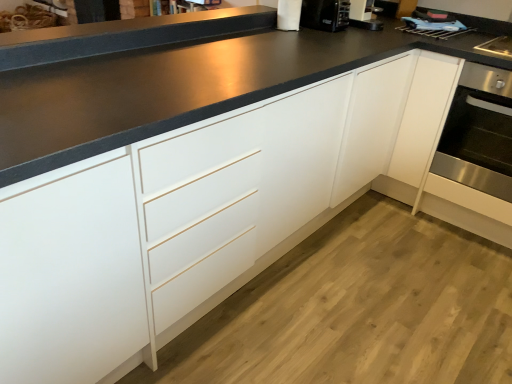
Where is `vacant space in front of black plastic coffee machine at upper right`? vacant space in front of black plastic coffee machine at upper right is located at coordinates (325, 39).